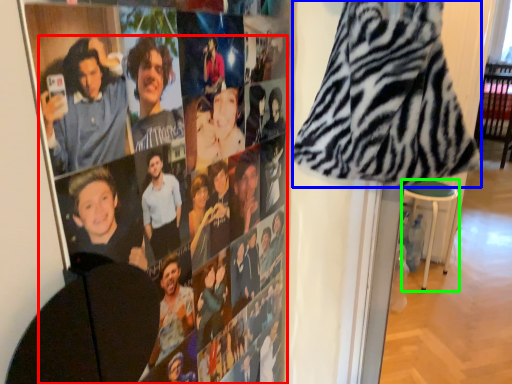
Question: Estimate the real-world distances between objects in this image. Which object is closer to person (highlighted by a red box), blanket (highlighted by a blue box) or bar stool (highlighted by a green box)?

Choices:
 (A) blanket
 (B) bar stool

Answer: (A)